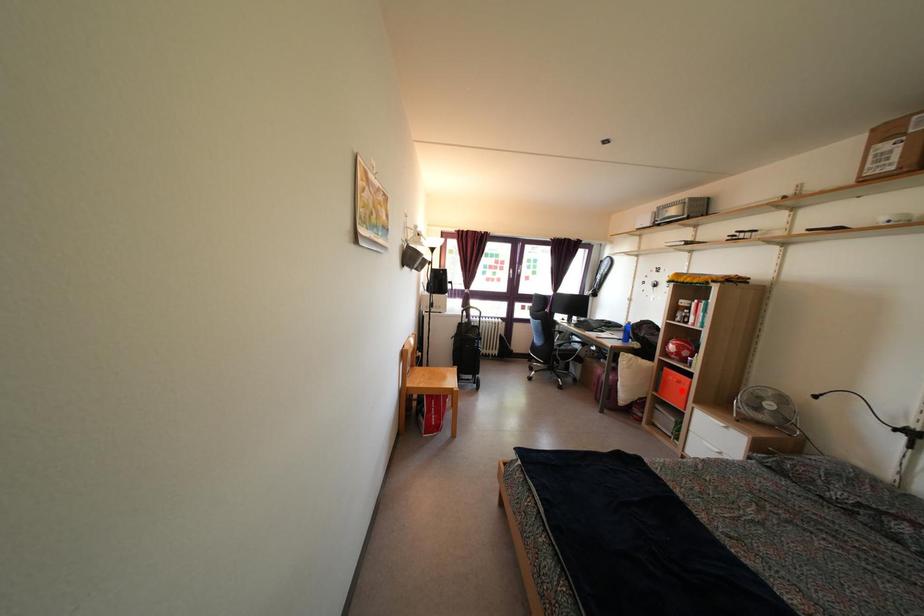
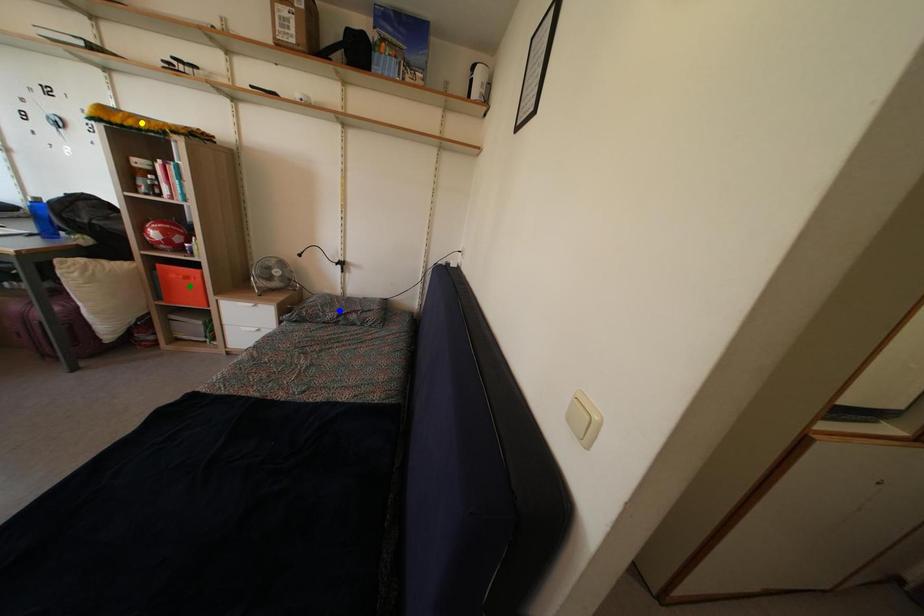
Question: I am providing you with two images of the same scene from different viewpoints. A red point is marked on the first image. You are given multiple points on the second image. Which point in image 2 is actually the same real-world point as the red point in image 1?

Choices:
 (A) blue point
 (B) green point
 (C) yellow point

Answer: (B)